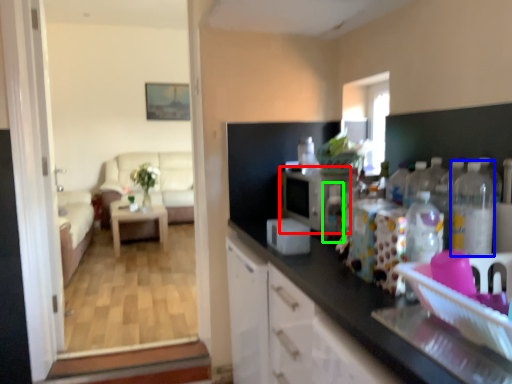
Question: Which object is the farthest from appliance (highlighted by a red box)? Choose among these: bottle (highlighted by a blue box) or bottle (highlighted by a green box).

Choices:
 (A) bottle
 (B) bottle

Answer: (A)